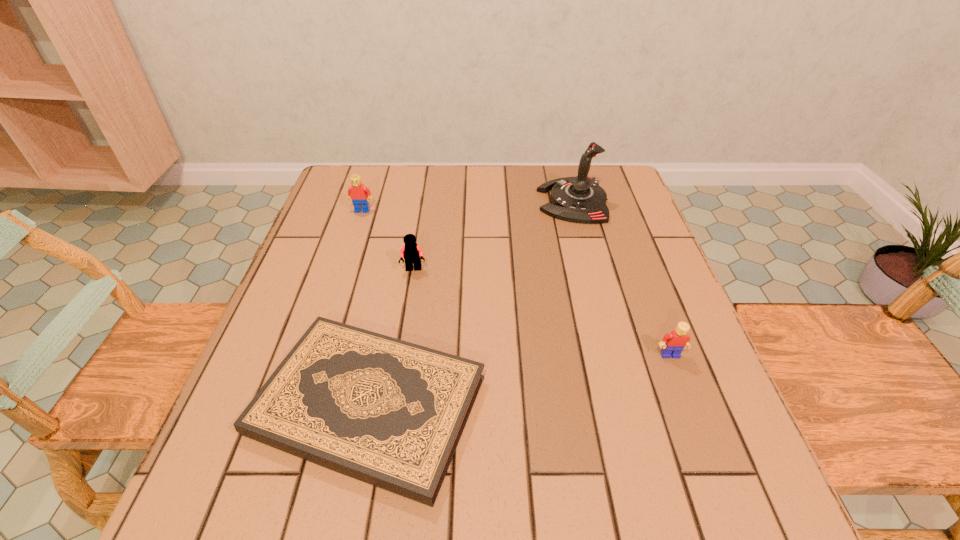
Identify which Lego is the nearest to the rightmost Lego. Please provide its 2D coordinates. Your answer should be formatted as a tuple, i.e. [(x, y)], where the tuple contains the x and y coordinates of a point satisfying the conditions above.

[(412, 253)]

Identify which Lego is the third nearest to the joystick. Please provide its 2D coordinates. Your answer should be formatted as a tuple, i.e. [(x, y)], where the tuple contains the x and y coordinates of a point satisfying the conditions above.

[(359, 194)]

Identify the location of vacant space that satisfies the following two spatial constraints: 1. on the handle side of the joystick; 2. on the face of the farthest Lego. (575, 210).

This screenshot has height=540, width=960. I want to click on free spot that satisfies the following two spatial constraints: 1. on the handle side of the tallest object; 2. on the face of the leftmost Lego, so point(575,210).

Identify the location of free spot that satisfies the following two spatial constraints: 1. on the face of the leftmost Lego; 2. on the left side of the shortest object. This screenshot has height=540, width=960. (299, 406).

The height and width of the screenshot is (540, 960). In order to click on vacant region that satisfies the following two spatial constraints: 1. on the handle side of the tallest object; 2. on the face of the farthest Lego in this screenshot , I will do `click(575, 210)`.

Locate an element on the screen. The width and height of the screenshot is (960, 540). free space in the image that satisfies the following two spatial constraints: 1. on the handle side of the tallest object; 2. on the face of the farthest Lego is located at coordinates (575, 210).

This screenshot has width=960, height=540. I want to click on free point that satisfies the following two spatial constraints: 1. on the handle side of the tallest object; 2. on the front side of the hardback book, so click(x=627, y=406).

The height and width of the screenshot is (540, 960). Find the location of `free space in the image that satisfies the following two spatial constraints: 1. on the handle side of the joystick; 2. on the face of the farthest Lego`. free space in the image that satisfies the following two spatial constraints: 1. on the handle side of the joystick; 2. on the face of the farthest Lego is located at coordinates (575, 210).

The width and height of the screenshot is (960, 540). What are the coordinates of `vacant space that satisfies the following two spatial constraints: 1. on the handle side of the tallest object; 2. on the front-facing side of the second Lego from right to left` in the screenshot? It's located at (590, 269).